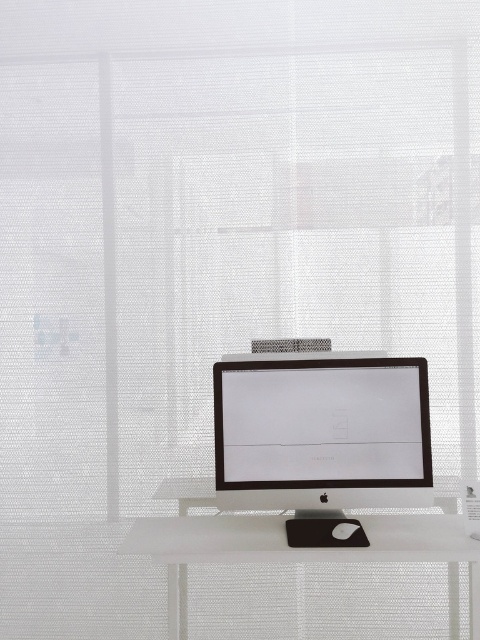
You are setting up a new monitor in your workspace. You have a satin black monitor at center and a white matte computer desk at center. Which object is positioned higher in the scene?

The satin black monitor at center is located above the white matte computer desk at center, so it is positioned higher in the scene.

You are setting up your workspace and want to place a new keyboard between the satin black monitor at center and the black plastic mouse at center. Based on their positions, which side of the monitor should the keyboard be placed on?

The satin black monitor at center is to the left of the black plastic mouse at center, so the keyboard should be placed to the right side of the satin black monitor at center to position it between them.

You are setting up a new desk and want to place a 12 inch wide laptop between the satin black monitor at center and the black plastic mouse at center. Can the laptop fit in the space between them?

The distance between the satin black monitor at center and the black plastic mouse at center is 14.04 inches. Since the laptop is 12 inches wide, it can fit in the space between them as there is enough room.